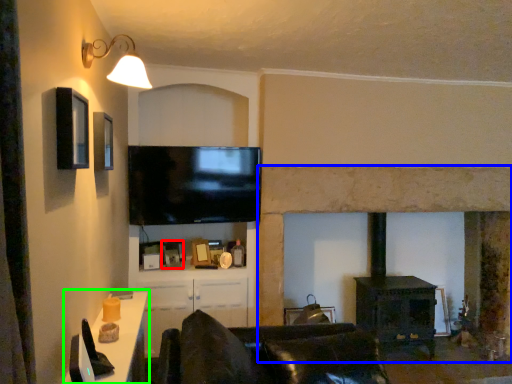
Question: Considering the real-world distances, which object is farthest from picture frame (highlighted by a red box)? fireplace (highlighted by a blue box) or table (highlighted by a green box)?

Choices:
 (A) fireplace
 (B) table

Answer: (B)